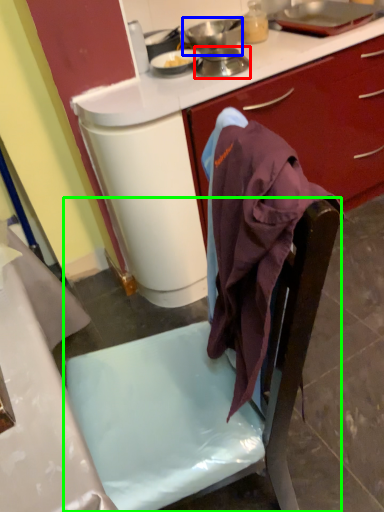
Question: Based on their relative distances, which object is nearer to kitchen appliance (highlighted by a red box)? Choose from kitchen appliance (highlighted by a blue box) and chair (highlighted by a green box).

Choices:
 (A) kitchen appliance
 (B) chair

Answer: (A)